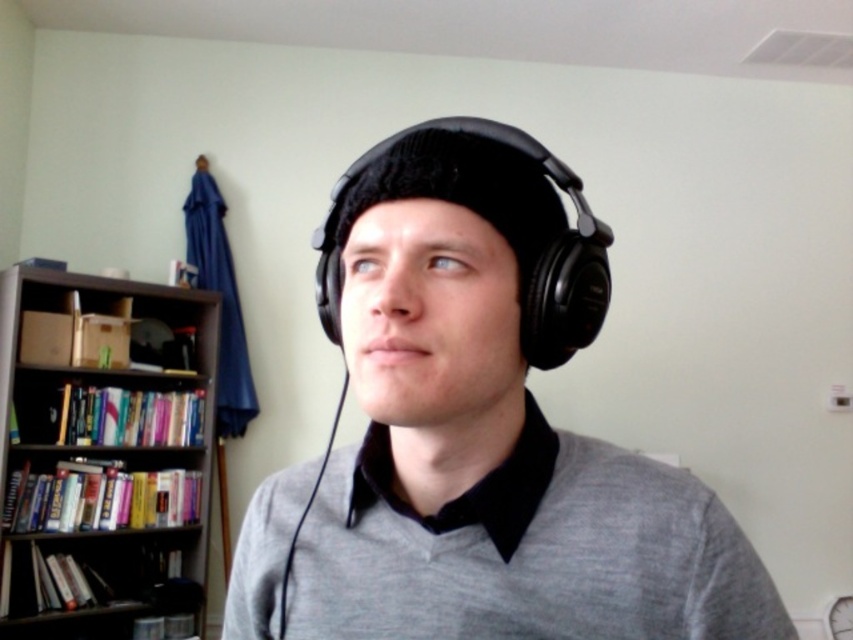
Question: Is matte black headphones at center further to the viewer compared to dark wood bookcase at left?

Choices:
 (A) yes
 (B) no

Answer: (B)

Question: Which of the following is the closest to the observer?

Choices:
 (A) (490, 605)
 (B) (39, 528)

Answer: (A)

Question: Based on their relative distances, which object is farther from the matte black headphones at center?

Choices:
 (A) dark wood bookcase at left
 (B) gray cotton sweater at center

Answer: (A)

Question: Is matte black headphones at center above dark wood bookcase at left?

Choices:
 (A) yes
 (B) no

Answer: (A)

Question: Which object appears farthest from the camera in this image?

Choices:
 (A) matte black headphones at center
 (B) dark wood bookcase at left

Answer: (B)

Question: Can you confirm if gray cotton sweater at center is smaller than dark wood bookcase at left?

Choices:
 (A) yes
 (B) no

Answer: (A)